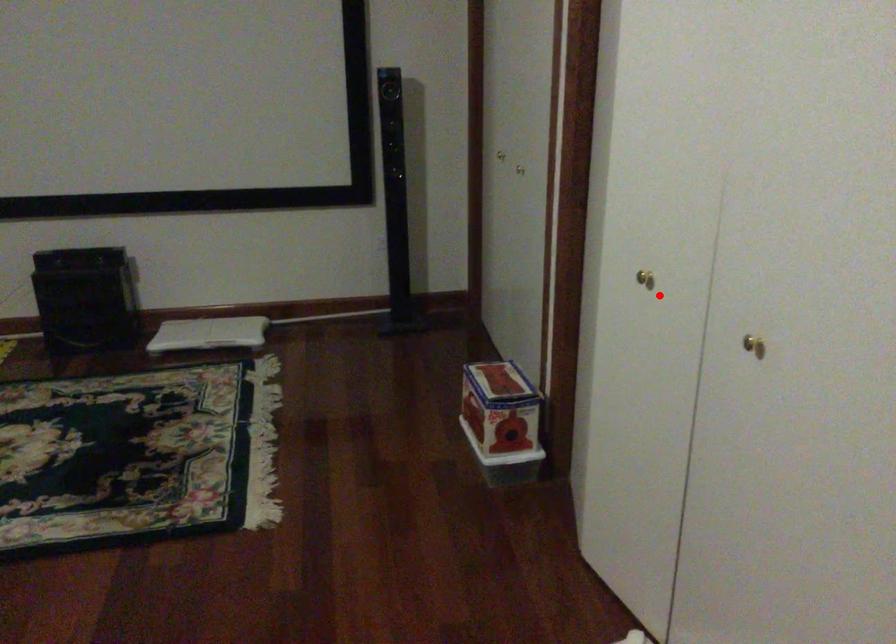
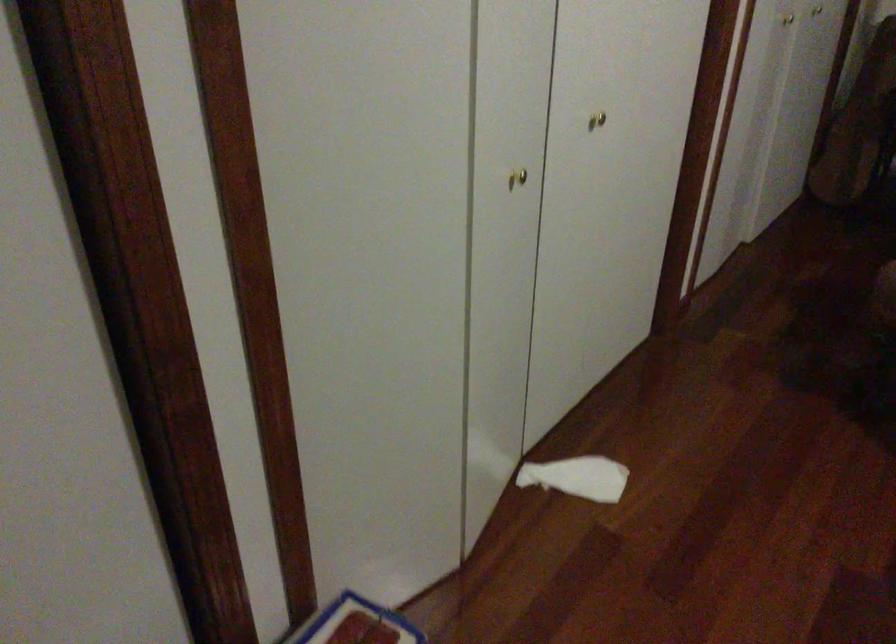
Question: I am providing you with two images of the same scene from different viewpoints. Image1 has a red point marked. In image2, the corresponding 3D location appears at what relative position? Reply with the corresponding letter.

Choices:
 (A) Closer
 (B) Farther

Answer: (A)